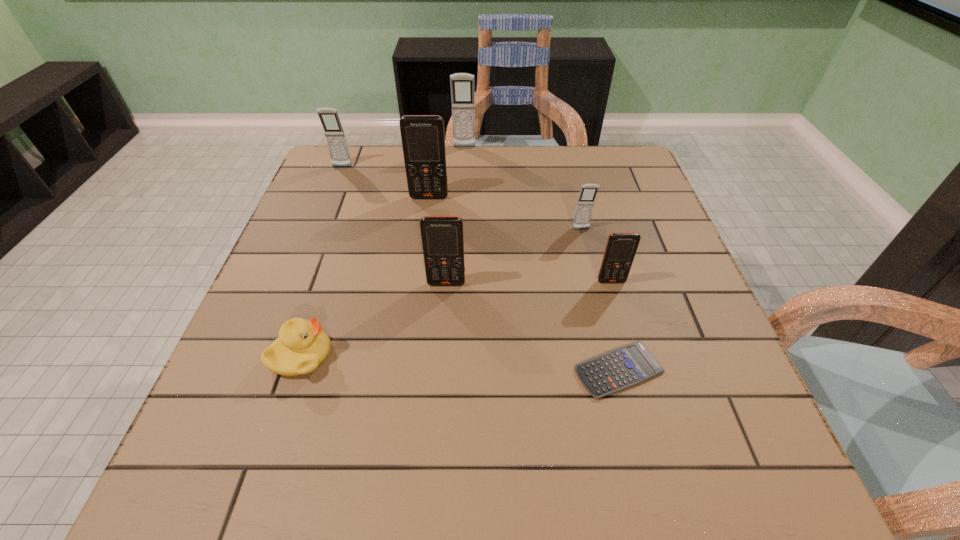
Identify the location of empty space between the fourth farthest object and the second smallest orange cellular telephone. The height and width of the screenshot is (540, 960). (514, 256).

At what (x,y) coordinates should I click in order to perform the action: click on vacant space that's between the second biggest gray cellular telephone and the second gray cellular telephone from left to right. Please return your answer as a coordinate pair (x, y). Looking at the image, I should click on (403, 157).

Where is `vacant space that's between the rightmost gray cellular telephone and the biggest orange cellular telephone`? This screenshot has height=540, width=960. vacant space that's between the rightmost gray cellular telephone and the biggest orange cellular telephone is located at coordinates 505,213.

Identify the location of object that is the fourth closest to the shortest object. (302, 346).

Identify which object is the nearest to the calculator. Please provide its 2D coordinates. Your answer should be formatted as a tuple, i.e. [(x, y)], where the tuple contains the x and y coordinates of a point satisfying the conditions above.

[(621, 247)]

Locate which cellular telephone ranks fifth in proximity to the second smallest gray cellular telephone. Please provide its 2D coordinates. Your answer should be formatted as a tuple, i.e. [(x, y)], where the tuple contains the x and y coordinates of a point satisfying the conditions above.

[(621, 247)]

Where is `cellular telephone that can be found as the second closest to the rightmost orange cellular telephone`? The image size is (960, 540). cellular telephone that can be found as the second closest to the rightmost orange cellular telephone is located at coordinates (442, 237).

Select which gray cellular telephone is the second closest to the farthest object. Please provide its 2D coordinates. Your answer should be formatted as a tuple, i.e. [(x, y)], where the tuple contains the x and y coordinates of a point satisfying the conditions above.

[(588, 192)]

Locate an element on the screen. The height and width of the screenshot is (540, 960). gray cellular telephone that is the third closest to the farthest orange cellular telephone is located at coordinates (588, 192).

Select which orange cellular telephone is the second closest to the second biggest orange cellular telephone. Please provide its 2D coordinates. Your answer should be formatted as a tuple, i.e. [(x, y)], where the tuple contains the x and y coordinates of a point satisfying the conditions above.

[(423, 140)]